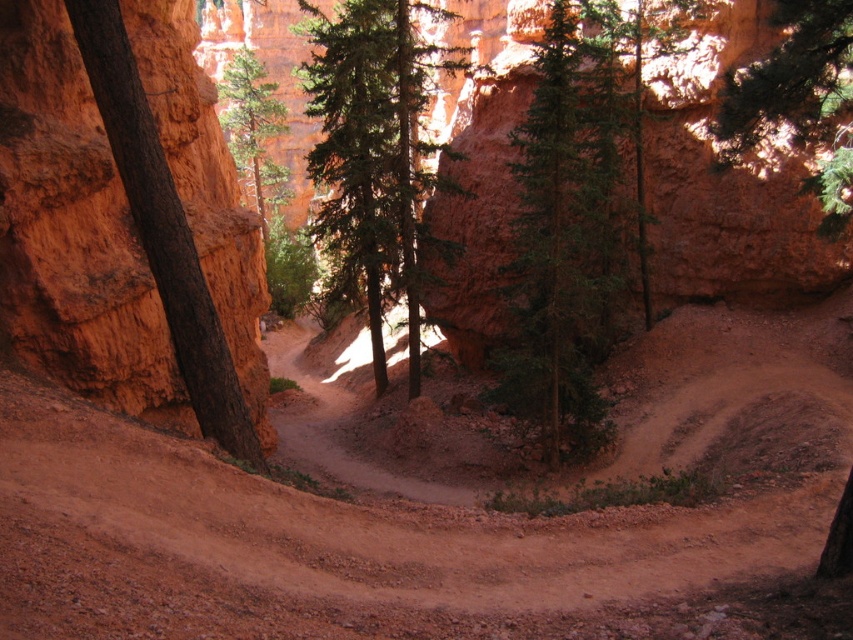
Does green matte tree at center have a lesser width compared to green textured tree at center?

Indeed, green matte tree at center has a lesser width compared to green textured tree at center.

Does green matte tree at center have a larger size compared to green textured tree at center?

No.

Which is behind, point (560, 396) or point (323, 33)?

The point (323, 33) is more distant.

This screenshot has height=640, width=853. I want to click on green matte tree at center, so (x=566, y=221).

Which of these two, dusty brown dirt track at center or green textured pine tree at upper right, stands shorter?

Standing shorter between the two is dusty brown dirt track at center.

Is point (830, 406) positioned behind point (726, 140)?

No.

Where is `dusty brown dirt track at center`? dusty brown dirt track at center is located at coordinates (440, 513).

Who is higher up, dusty brown dirt track at center or green matte tree at center?

green matte tree at center is above.

Can you confirm if dusty brown dirt track at center is shorter than green matte tree at center?

Indeed, dusty brown dirt track at center has a lesser height compared to green matte tree at center.

Between point (744, 490) and point (523, 392), which one is positioned behind?

Positioned behind is point (523, 392).

Locate an element on the screen. The image size is (853, 640). dusty brown dirt track at center is located at coordinates (440, 513).